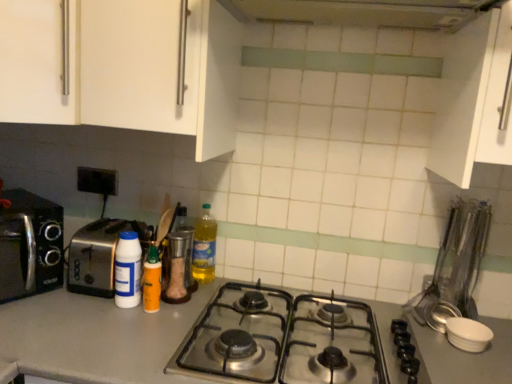
What do you see at coordinates (282, 338) in the screenshot? The height and width of the screenshot is (384, 512). I see `stainless steel gas stove at center` at bounding box center [282, 338].

Describe the element at coordinates (128, 270) in the screenshot. I see `white matte bottle at center-left, which is the first bottle from left to right` at that location.

Measure the distance between point (90, 46) and camera.

Point (90, 46) and camera are 3.33 feet apart.

Measure the distance between point (240, 16) and camera.

4.04 feet.

The image size is (512, 384). Describe the element at coordinates (152, 281) in the screenshot. I see `orange matte squeeze bottle at center, placed as the third bottle when sorted from right to left` at that location.

In order to face satin silver toaster at left, the first toaster viewed from the right, should I rotate leftwards or rightwards?

To align with it, rotate left about 19.379°.

At what (x,y) coordinates should I click in order to perform the action: click on black plastic outlet at upper left. Please return your answer as a coordinate pair (x, y). The height and width of the screenshot is (384, 512). Looking at the image, I should click on (97, 180).

Could you tell me if metallic silver exhaust hood at upper center is turned towards orange matte squeeze bottle at center, the second bottle viewed from the left?

No, metallic silver exhaust hood at upper center does not turn towards orange matte squeeze bottle at center, the second bottle viewed from the left.

How many degrees apart are the facing directions of metallic silver exhaust hood at upper center and orange matte squeeze bottle at center, the second bottle viewed from the left?

metallic silver exhaust hood at upper center and orange matte squeeze bottle at center, the second bottle viewed from the left, are facing 0.935 degrees away from each other.

Considering the positions of objects metallic silver exhaust hood at upper center and orange matte squeeze bottle at center, placed as the third bottle when sorted from right to left, in the image provided, who is more to the right, metallic silver exhaust hood at upper center or orange matte squeeze bottle at center, placed as the third bottle when sorted from right to left,?

metallic silver exhaust hood at upper center.

Based on the photo, is orange matte squeeze bottle at center, the second bottle viewed from the left, wider than metallic silver exhaust hood at upper center?

In fact, orange matte squeeze bottle at center, the second bottle viewed from the left, might be narrower than metallic silver exhaust hood at upper center.

From the image's perspective, is orange matte squeeze bottle at center, placed as the third bottle when sorted from right to left, beneath metallic silver exhaust hood at upper center?

Yes.

Based on the photo, based on their positions, is orange matte squeeze bottle at center, the second bottle viewed from the left, located to the left or right of metallic silver exhaust hood at upper center?

In the image, orange matte squeeze bottle at center, the second bottle viewed from the left, appears on the left side of metallic silver exhaust hood at upper center.

From the image's perspective, which object appears higher, stainless steel utensils at right or metallic silver exhaust hood at upper center?

metallic silver exhaust hood at upper center appears higher in the image.

Considering the sizes of objects stainless steel utensils at right and metallic silver exhaust hood at upper center in the image provided, who is bigger, stainless steel utensils at right or metallic silver exhaust hood at upper center?

Bigger between the two is metallic silver exhaust hood at upper center.

Considering the positions of point (411, 312) and point (415, 3), is point (411, 312) closer or farther from the camera than point (415, 3)?

Point (411, 312) is positioned farther from the camera compared to point (415, 3).

Considering the positions of objects stainless steel utensils at right and metallic silver exhaust hood at upper center in the image provided, who is behind, stainless steel utensils at right or metallic silver exhaust hood at upper center?

stainless steel utensils at right is further from the camera.

Between point (269, 20) and point (106, 287), which one is positioned in front?

Point (106, 287)

Between metallic silver exhaust hood at upper center and satin silver toaster at left, the first toaster viewed from the right, which one is positioned behind?

satin silver toaster at left, the first toaster viewed from the right, is further from the camera.

Is metallic silver exhaust hood at upper center aimed at satin silver toaster at left, the 2th toaster from the left?

No, metallic silver exhaust hood at upper center does not turn towards satin silver toaster at left, the 2th toaster from the left.

Can you confirm if metallic silver exhaust hood at upper center is shorter than satin silver toaster at left, the first toaster viewed from the right?

Correct, metallic silver exhaust hood at upper center is not as tall as satin silver toaster at left, the first toaster viewed from the right.

From a real-world perspective, relative to metallic silver shaker at center, is translucent plastic bottle at center, which ranks as the first bottle in right-to-left order, vertically above or below?

Clearly, from a real-world perspective, translucent plastic bottle at center, which ranks as the first bottle in right-to-left order, is above metallic silver shaker at center.

Which object is wider, translucent plastic bottle at center, acting as the 4th bottle starting from the left, or metallic silver shaker at center?

translucent plastic bottle at center, acting as the 4th bottle starting from the left, is wider.

Which is nearer, (194, 261) or (181, 270)?

The point (181, 270) is closer.

Is translucent plastic bottle at center, which ranks as the first bottle in right-to-left order, aimed at metallic silver shaker at center?

Yes, translucent plastic bottle at center, which ranks as the first bottle in right-to-left order, is turned towards metallic silver shaker at center.

Looking at this image, is white matte cabinet at upper right, which is the 1th cabinetry from right to left, surrounded by metallic silver exhaust hood at upper center?

No, white matte cabinet at upper right, which is the 1th cabinetry from right to left, is not a part of metallic silver exhaust hood at upper center.

Considering the relative sizes of metallic silver exhaust hood at upper center and white matte cabinet at upper right, which is the 1th cabinetry from right to left, in the image provided, is metallic silver exhaust hood at upper center shorter than white matte cabinet at upper right, which is the 1th cabinetry from right to left,?

Indeed, metallic silver exhaust hood at upper center has a lesser height compared to white matte cabinet at upper right, which is the 1th cabinetry from right to left.

From the image's perspective, who appears lower, metallic silver exhaust hood at upper center or white matte cabinet at upper right, which ranks as the second cabinetry in left-to-right order?

white matte cabinet at upper right, which ranks as the second cabinetry in left-to-right order, appears lower in the image.

From a real-world perspective, between metallic silver exhaust hood at upper center and white matte cabinet at upper right, which is the 1th cabinetry from right to left, who is vertically lower?

white matte cabinet at upper right, which is the 1th cabinetry from right to left, is physically lower.

What's the angular difference between metallic silver canister at center, positioned as the third bottle in left-to-right order, and stainless steel gas stove at center's facing directions?

1.62 degrees.

Which object is further away from the camera, metallic silver canister at center, positioned as the third bottle in left-to-right order, or stainless steel gas stove at center?

metallic silver canister at center, positioned as the third bottle in left-to-right order, is behind.

From a real-world perspective, between metallic silver canister at center, marked as the second bottle in a right-to-left arrangement, and stainless steel gas stove at center, who is vertically lower?

stainless steel gas stove at center.

Which is nearer, (177, 227) or (203, 319)?

Point (203, 319)

Find the location of a particular element. The height and width of the screenshot is (384, 512). exhaust hood above the orange matte squeeze bottle at center, the second bottle viewed from the left (from a real-world perspective) is located at coordinates (364, 12).

The image size is (512, 384). I want to click on exhaust hood that is in front of the orange matte squeeze bottle at center, the second bottle viewed from the left, so click(364, 12).

Which object lies further to the anchor point metallic silver exhaust hood at upper center, silver metallic toaster at left, the first toaster from the left, or metallic silver canister at center, marked as the second bottle in a right-to-left arrangement?

silver metallic toaster at left, the first toaster from the left, is further to metallic silver exhaust hood at upper center.

Considering their positions, is white matte cabinet at upper right, which ranks as the second cabinetry in left-to-right order, positioned closer to white matte bottle at center-left, marked as the fourth bottle in a right-to-left arrangement, than stainless steel utensils at right?

The object closer to white matte bottle at center-left, marked as the fourth bottle in a right-to-left arrangement, is stainless steel utensils at right.

From the picture: Based on their spatial positions, is stainless steel utensils at right or silver metallic toaster at left, the first toaster from the left, further from translucent plastic bottle at center, acting as the 4th bottle starting from the left?

Based on the image, stainless steel utensils at right appears to be further to translucent plastic bottle at center, acting as the 4th bottle starting from the left.

From the picture: From the image, which object appears to be nearer to white matte cabinet at upper right, which ranks as the second cabinetry in left-to-right order, orange matte squeeze bottle at center, placed as the third bottle when sorted from right to left, or satin silver toaster at left, the first toaster viewed from the right?

orange matte squeeze bottle at center, placed as the third bottle when sorted from right to left, lies closer to white matte cabinet at upper right, which ranks as the second cabinetry in left-to-right order, than the other object.

Estimate the real-world distances between objects in this image. Which object is further from silver metallic toaster at left, the first toaster from the left, white matte bottle at center-left, marked as the fourth bottle in a right-to-left arrangement, or black plastic outlet at upper left?

white matte bottle at center-left, marked as the fourth bottle in a right-to-left arrangement.

Based on their spatial positions, is stainless steel utensils at right or metallic silver exhaust hood at upper center closer to metallic silver shaker at center?

stainless steel utensils at right lies closer to metallic silver shaker at center than the other object.

Which object lies nearer to the anchor point metallic silver canister at center, positioned as the third bottle in left-to-right order, satin silver toaster at left, the 2th toaster from the left, or white matte bottle at center-left, which is the first bottle from left to right?

Among the two, white matte bottle at center-left, which is the first bottle from left to right, is located nearer to metallic silver canister at center, positioned as the third bottle in left-to-right order.

From the image, which object appears to be nearer to satin silver toaster at left, the first toaster viewed from the right, stainless steel gas stove at center or white matte cabinet at upper left, the 1th cabinetry from the left?

Based on the image, stainless steel gas stove at center appears to be nearer to satin silver toaster at left, the first toaster viewed from the right.

Identify the location of kitchen appliance between black plastic outlet at upper left and stainless steel utensils at right from left to right. Image resolution: width=512 pixels, height=384 pixels. (175, 269).

The height and width of the screenshot is (384, 512). I want to click on bottle that lies between white matte cabinet at upper left, which is the second cabinetry in right-to-left order, and metallic silver canister at center, marked as the second bottle in a right-to-left arrangement, from top to bottom, so click(204, 247).

Where is `kitchen appliance that lies between metallic silver exhaust hood at upper center and white matte bottle at center-left, marked as the fourth bottle in a right-to-left arrangement, from top to bottom`? This screenshot has width=512, height=384. kitchen appliance that lies between metallic silver exhaust hood at upper center and white matte bottle at center-left, marked as the fourth bottle in a right-to-left arrangement, from top to bottom is located at coordinates (175, 269).

At what (x,y) coordinates should I click in order to perform the action: click on exhaust hood situated between silver metallic toaster at left, the 2th toaster positioned from the right, and stainless steel utensils at right from left to right. Please return your answer as a coordinate pair (x, y). Looking at the image, I should click on (364, 12).